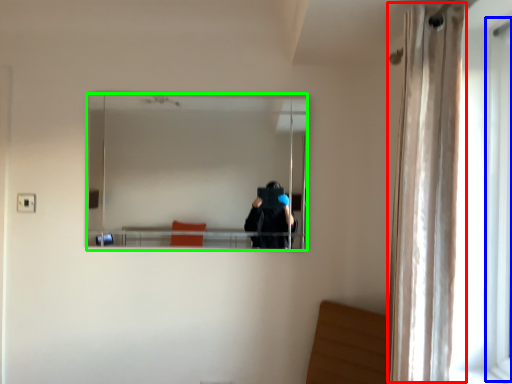
Question: Based on their relative distances, which object is farther from curtain (highlighted by a red box)? Choose from screen door (highlighted by a blue box) and mirror (highlighted by a green box).

Choices:
 (A) screen door
 (B) mirror

Answer: (B)